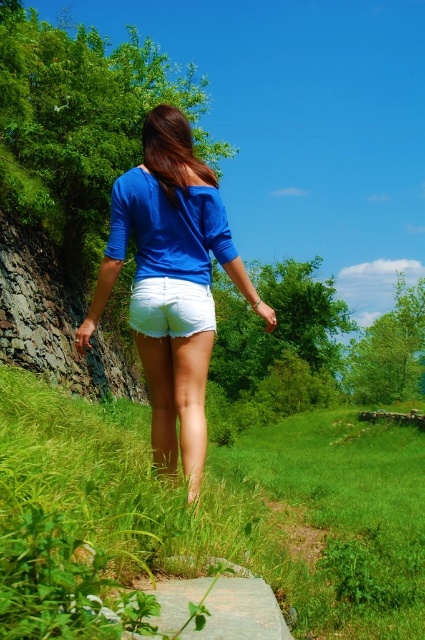
Question: Is the position of green grassy at lower left more distant than that of matte blue shirt at center?

Choices:
 (A) no
 (B) yes

Answer: (A)

Question: Among these points, which one is nearest to the camera?

Choices:
 (A) [x=362, y=532]
 (B) [x=25, y=336]
 (C) [x=170, y=284]
 (D) [x=183, y=428]

Answer: (D)

Question: Is green grassy at lower left to the left of rustic stone cliff at left from the viewer's perspective?

Choices:
 (A) yes
 (B) no

Answer: (B)

Question: Does rustic stone cliff at left come in front of white cotton shorts at center?

Choices:
 (A) yes
 (B) no

Answer: (B)

Question: Based on their relative distances, which object is farther from the matte blue shirt at center?

Choices:
 (A) green grassy at lower left
 (B) rustic stone cliff at left
 (C) white cotton shorts at center

Answer: (B)

Question: Which object is farther from the camera taking this photo?

Choices:
 (A) green grassy at lower left
 (B) rustic stone cliff at left

Answer: (B)